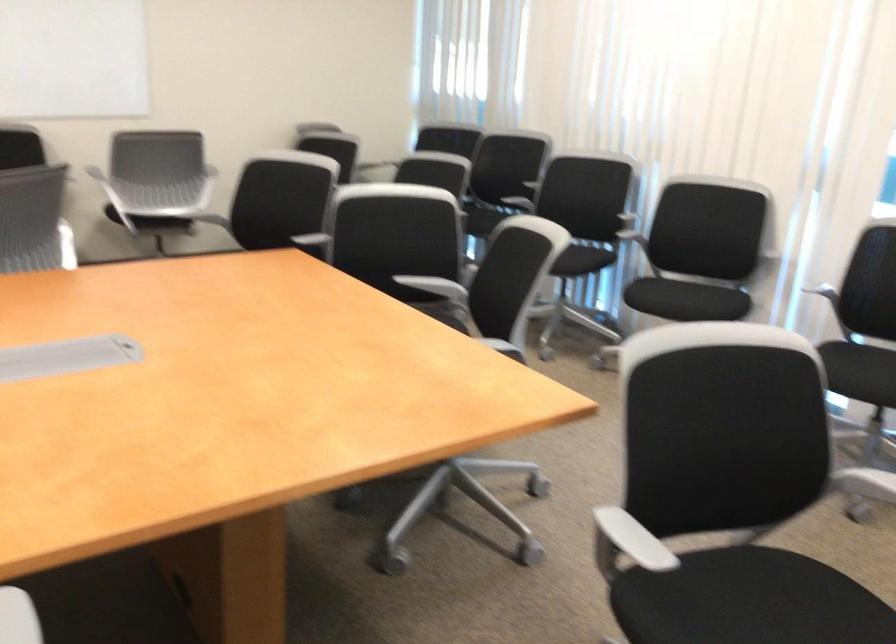
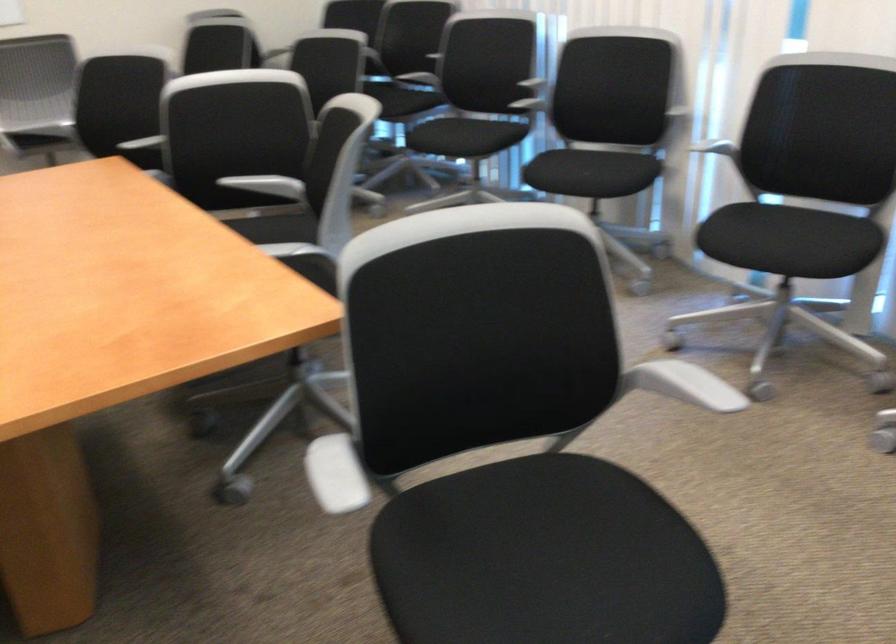
Where in the second image is the point corresponding to [433,283] from the first image?

(268, 185)